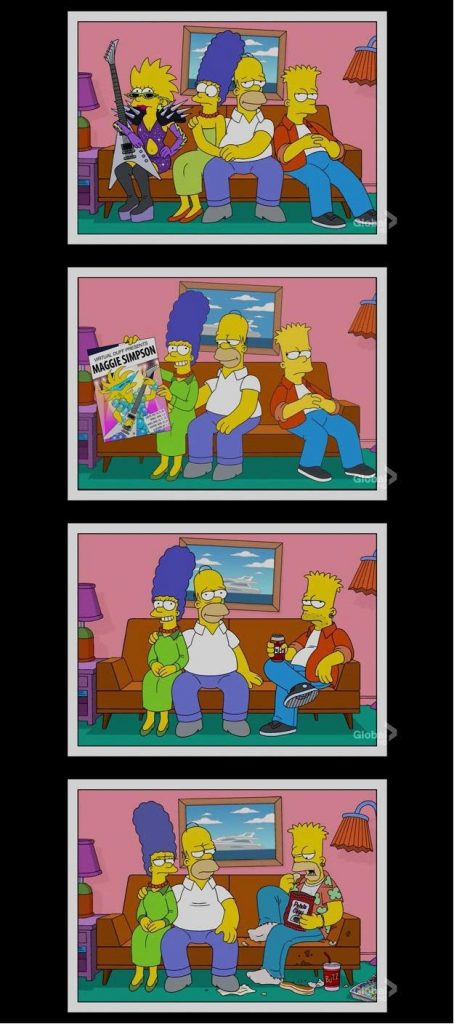
Identify the location of floor lamp. (352, 830), (366, 572), (368, 318), (363, 63).